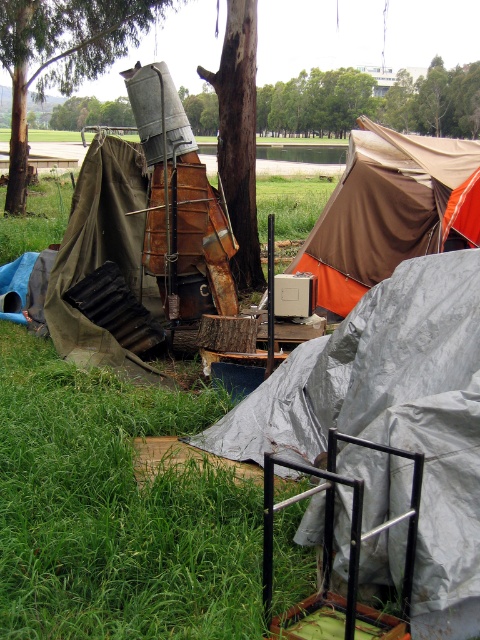
Question: Does brown canvas tent at upper center appear on the left side of brushed metal tree at upper center?

Choices:
 (A) no
 (B) yes

Answer: (A)

Question: Can you confirm if brown canvas tent at upper center is positioned to the right of brown rough tree trunk at center?

Choices:
 (A) yes
 (B) no

Answer: (A)

Question: Which is nearer to the brown canvas tent at upper center?

Choices:
 (A) silver metallic tent at center
 (B) brushed metal tree at upper center
 (C) brown rough tree trunk at center

Answer: (C)

Question: Which object is farther from the camera taking this photo?

Choices:
 (A) brown rough tree trunk at center
 (B) brushed metal tree at upper center
 (C) silver metallic tent at center

Answer: (B)

Question: Which of the following is the farthest from the observer?

Choices:
 (A) brown canvas tent at upper center
 (B) silver metallic tent at center
 (C) brown rough tree trunk at center

Answer: (C)

Question: Is silver metallic tent at center to the left of brushed metal tree at upper center from the viewer's perspective?

Choices:
 (A) yes
 (B) no

Answer: (B)